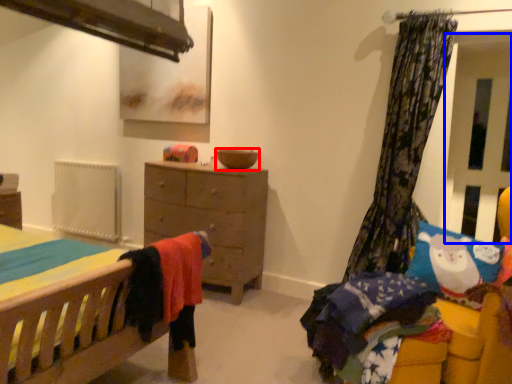
Question: Which object is further to the camera taking this photo, bowl (highlighted by a red box) or screen door (highlighted by a blue box)?

Choices:
 (A) bowl
 (B) screen door

Answer: (A)